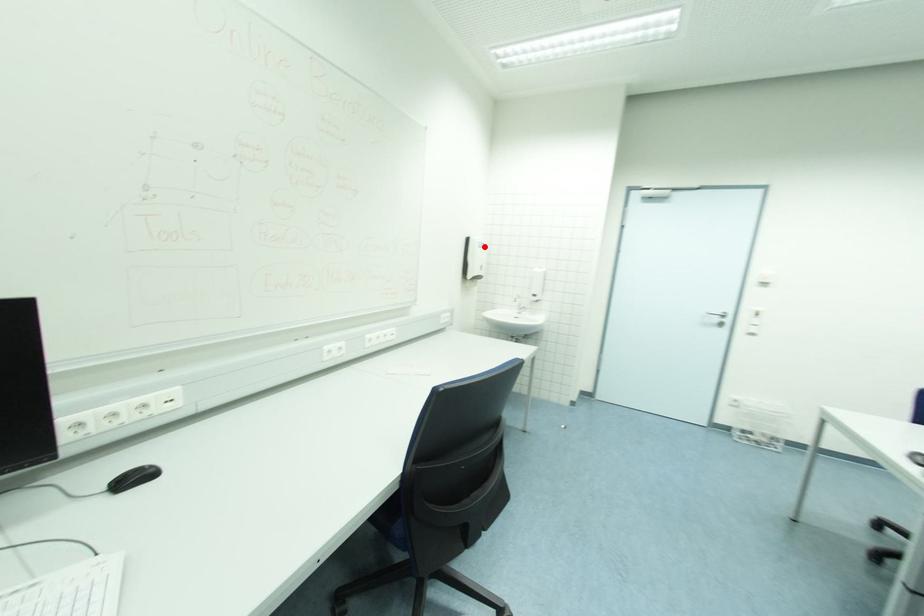
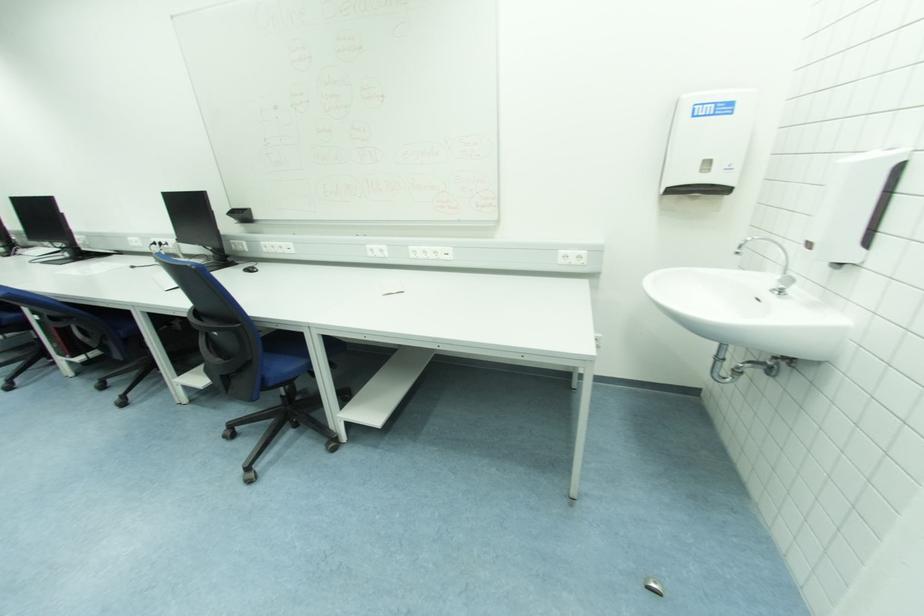
The point at the highlighted location is marked in the first image. Where is the corresponding point in the second image?

(731, 110)